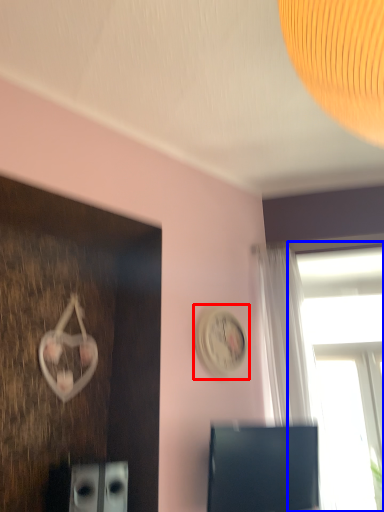
Question: Which point is closer to the camera, clock (highlighted by a red box) or window (highlighted by a blue box)?

Choices:
 (A) clock
 (B) window

Answer: (A)